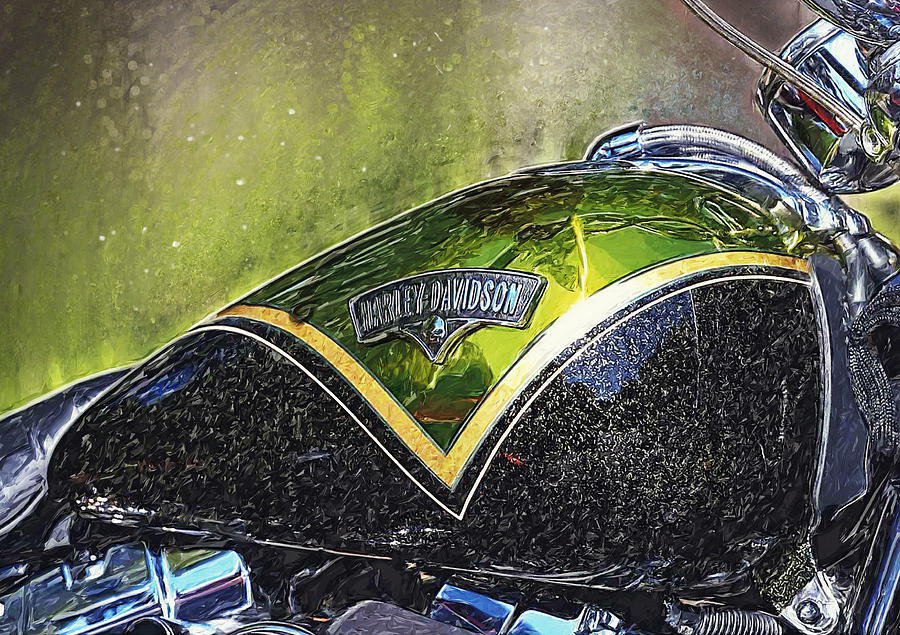
Image resolution: width=900 pixels, height=635 pixels. I want to click on metal applique, so click(x=446, y=296).